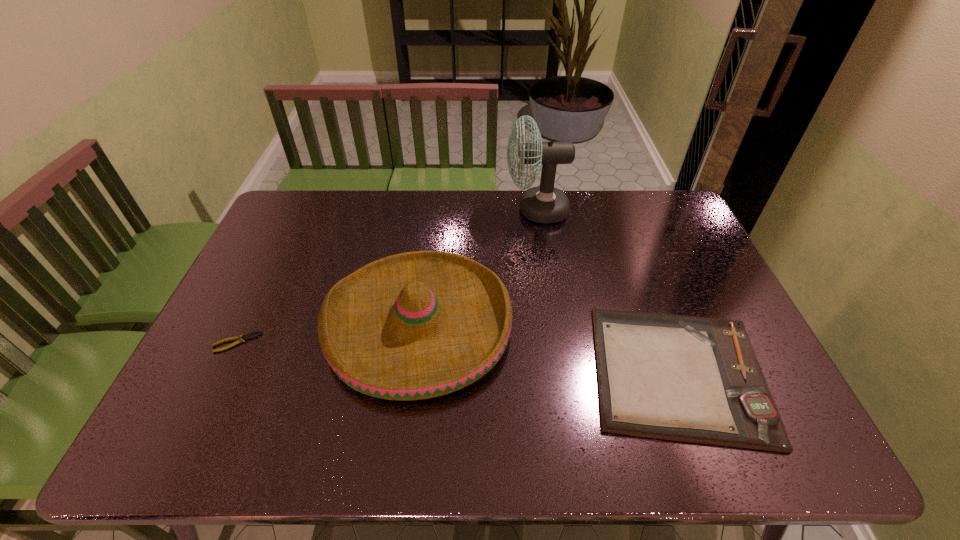
This screenshot has width=960, height=540. I want to click on vacant space at the left edge, so click(x=272, y=246).

I want to click on free space at the right edge of the desktop, so click(x=683, y=312).

The height and width of the screenshot is (540, 960). I want to click on vacant space at the far left corner, so click(x=299, y=227).

Find the location of `vacant space at the far right corner`. vacant space at the far right corner is located at coordinates (687, 228).

I want to click on free space between the second shortest object and the third object from right to left, so click(548, 348).

The image size is (960, 540). In order to click on free area in between the clipboard and the fan in this screenshot , I will do `click(608, 291)`.

Find the location of a particular element. The image size is (960, 540). vacant point located between the sombrero and the clipboard is located at coordinates (548, 348).

Locate an element on the screen. object that stands as the closest to the fan is located at coordinates (417, 325).

Select which object appears as the closest to the leftmost object. Please provide its 2D coordinates. Your answer should be formatted as a tuple, i.e. [(x, y)], where the tuple contains the x and y coordinates of a point satisfying the conditions above.

[(417, 325)]

The width and height of the screenshot is (960, 540). Identify the location of free location that satisfies the following two spatial constraints: 1. on the back side of the clipboard; 2. in front of the farthest object where the airflow is directed. (618, 210).